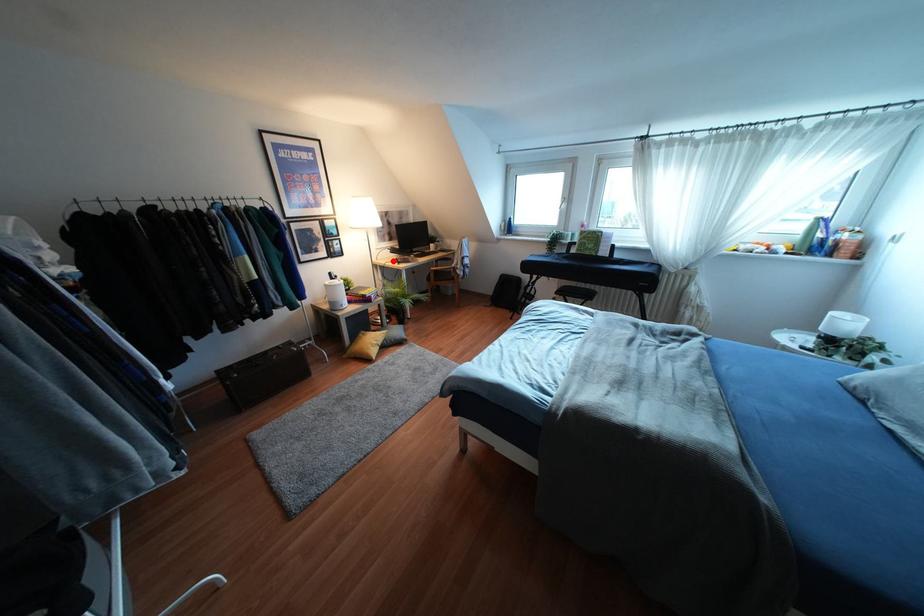
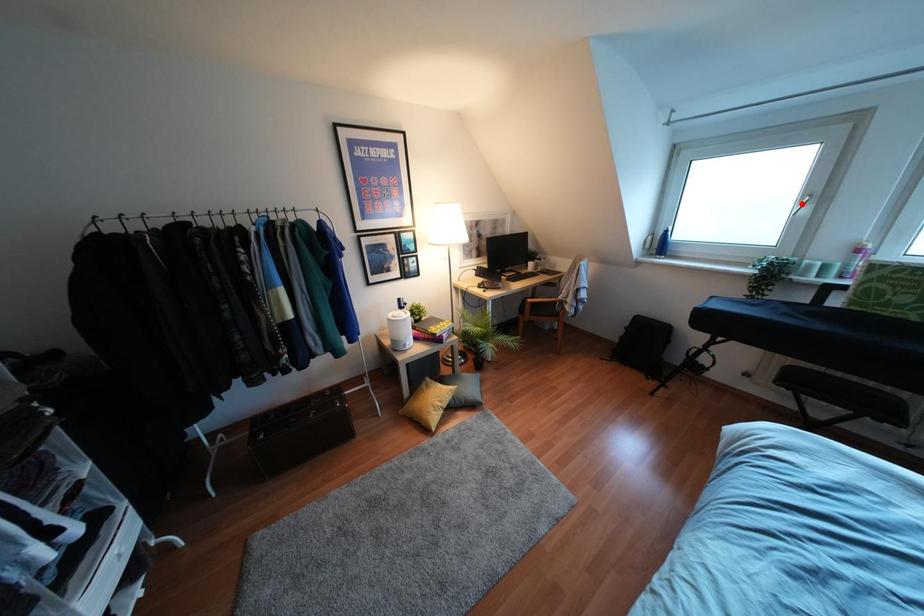
I am providing you with two images of the same scene from different viewpoints. A red point is marked on the first image and another point is marked on the second image. Is the red point in image1 aligned with the point shown in image2?

No